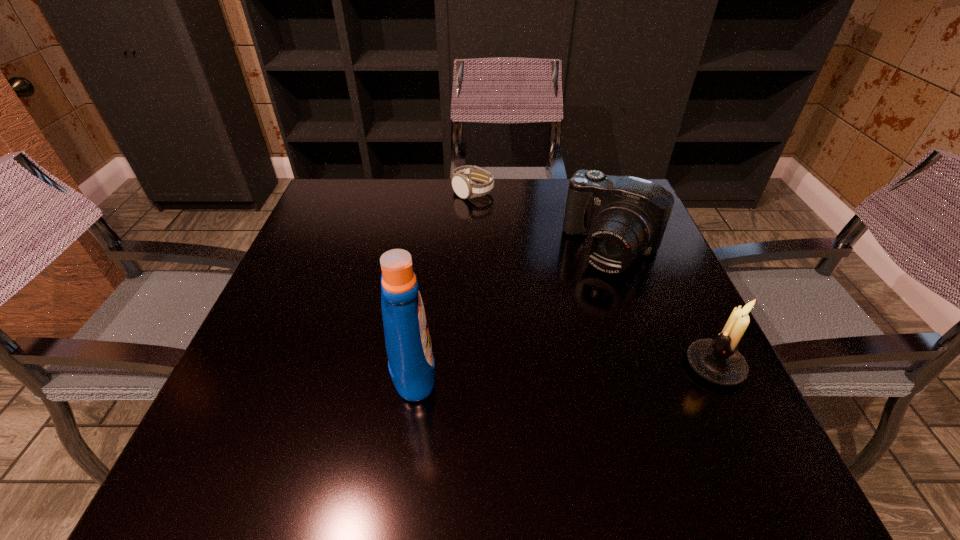
Where is `unoccupied area between the camera and the watch`? Image resolution: width=960 pixels, height=540 pixels. unoccupied area between the camera and the watch is located at coordinates (542, 220).

You are a GUI agent. You are given a task and a screenshot of the screen. Output one action in this format:
    pyautogui.click(x=<x>, y=<y>)
    Task: Click on the blank region between the shortest object and the second farthest object
    The height and width of the screenshot is (540, 960).
    Given the screenshot: What is the action you would take?
    pyautogui.click(x=542, y=220)

Where is `empty space that is in between the detergent and the camera`? empty space that is in between the detergent and the camera is located at coordinates (513, 308).

Find the location of a particular element. This screenshot has height=540, width=960. free space between the third nearest object and the watch is located at coordinates (542, 220).

At what (x,y) coordinates should I click in order to perform the action: click on empty space between the candle holder and the leftmost object. Please return your answer as a coordinate pair (x, y). This screenshot has width=960, height=540. Looking at the image, I should click on pos(564,366).

Locate an element on the screen. blank region between the candle holder and the third nearest object is located at coordinates (663, 307).

Locate an element on the screen. unoccupied position between the second object from left to right and the candle holder is located at coordinates (594, 279).

Locate an element on the screen. This screenshot has width=960, height=540. free space between the candle holder and the camera is located at coordinates (663, 307).

Identify which object is located as the second nearest to the candle holder. Please provide its 2D coordinates. Your answer should be formatted as a tuple, i.e. [(x, y)], where the tuple contains the x and y coordinates of a point satisfying the conditions above.

[(411, 364)]

Image resolution: width=960 pixels, height=540 pixels. In order to click on object that is the second nearest to the candle holder in this screenshot , I will do `click(411, 364)`.